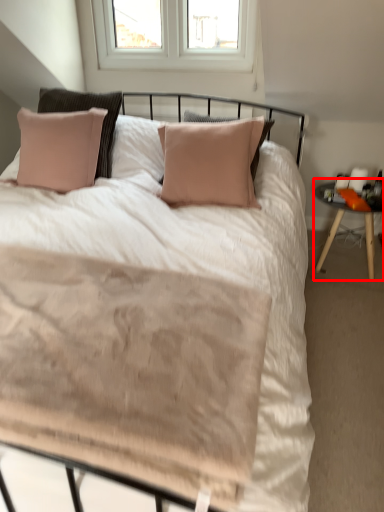
Question: Where is nightstand (annotated by the red box) located in relation to bed in the image?

Choices:
 (A) left
 (B) right

Answer: (B)